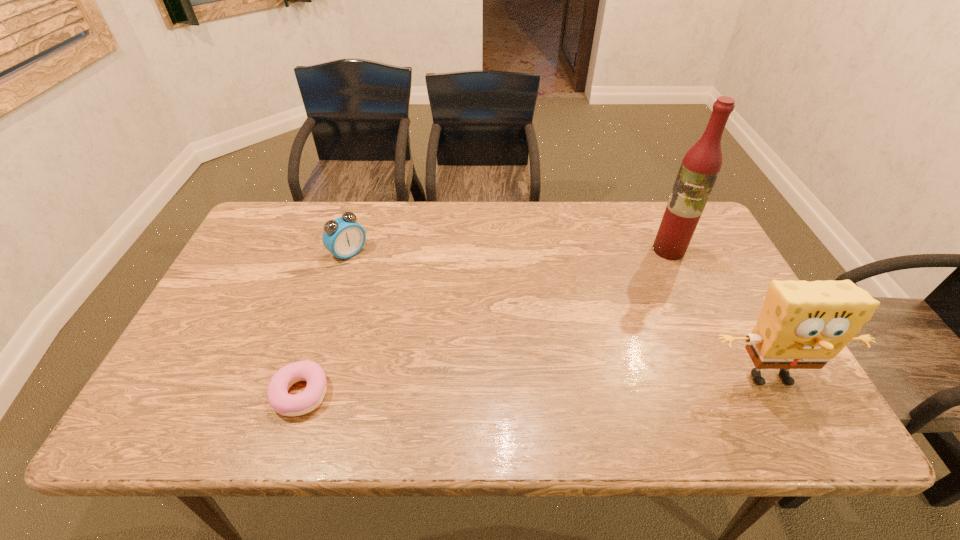
Where is `vacant space situated 0.290m on the label of the tallest object`? vacant space situated 0.290m on the label of the tallest object is located at coordinates (612, 313).

At what (x,y) coordinates should I click in order to perform the action: click on alarm clock situated at the far edge. Please return your answer as a coordinate pair (x, y). The height and width of the screenshot is (540, 960). Looking at the image, I should click on (343, 237).

Locate an element on the screen. The height and width of the screenshot is (540, 960). liquor that is at the far edge is located at coordinates (700, 167).

Where is `pastry at the near edge`? This screenshot has width=960, height=540. pastry at the near edge is located at coordinates (283, 403).

The image size is (960, 540). Identify the location of sponge present at the near edge. (803, 325).

In order to click on sponge positioned at the right edge in this screenshot , I will do coord(803,325).

Image resolution: width=960 pixels, height=540 pixels. Find the location of `liquor located at the right edge`. liquor located at the right edge is located at coordinates (700, 167).

Where is `object situated at the far right corner`? Image resolution: width=960 pixels, height=540 pixels. object situated at the far right corner is located at coordinates (700, 167).

The image size is (960, 540). I want to click on object present at the near right corner, so click(803, 325).

Where is `vacant space at the far edge of the desktop`? This screenshot has height=540, width=960. vacant space at the far edge of the desktop is located at coordinates (402, 233).